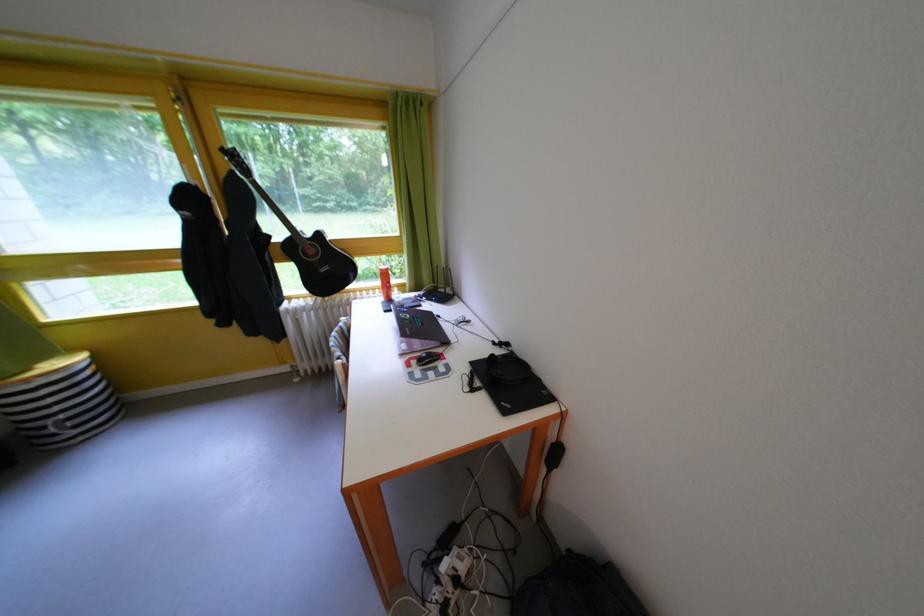
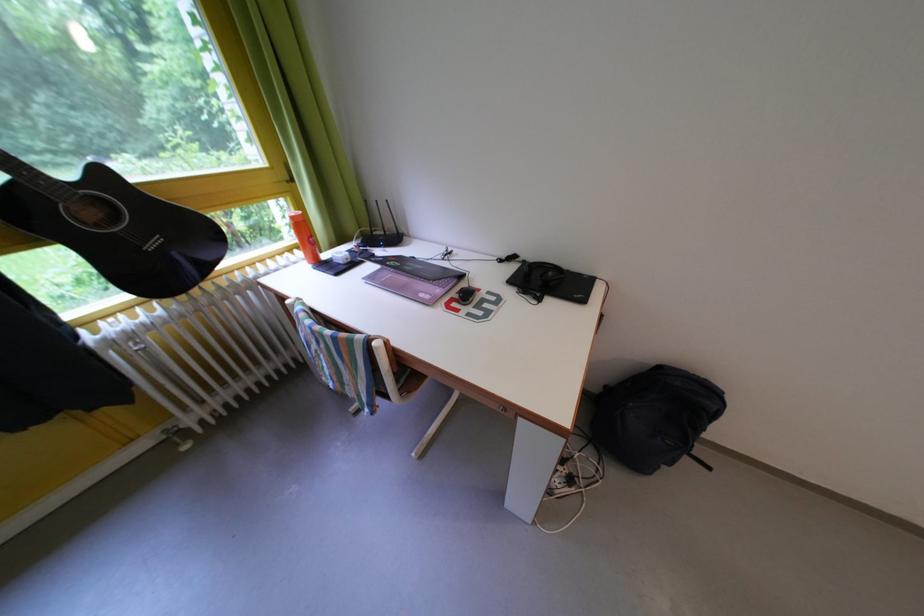
In the second image, find the point that corresponds to point (453, 297) in the first image.

(392, 238)